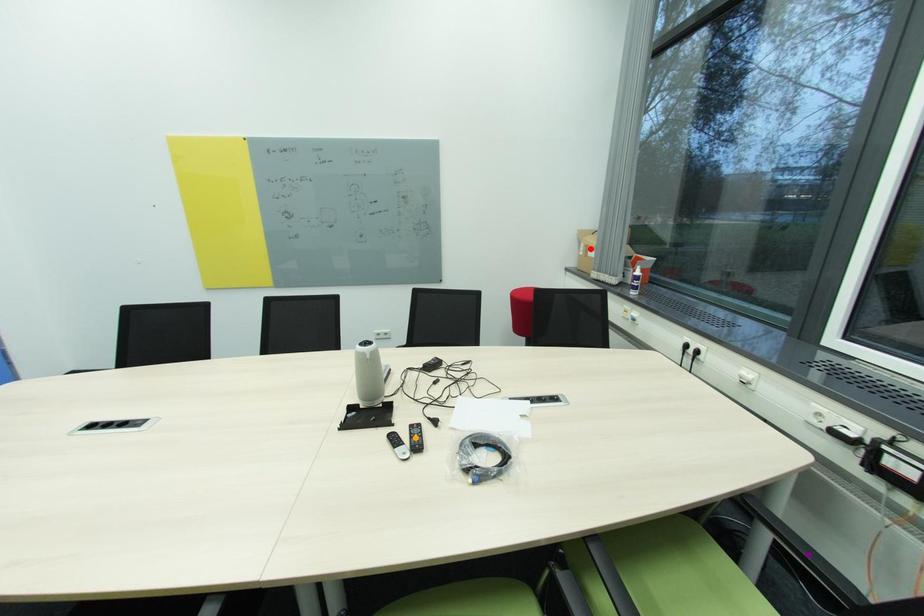
Order these from farthest to nearest:
red point, purple point, orange point

red point → orange point → purple point